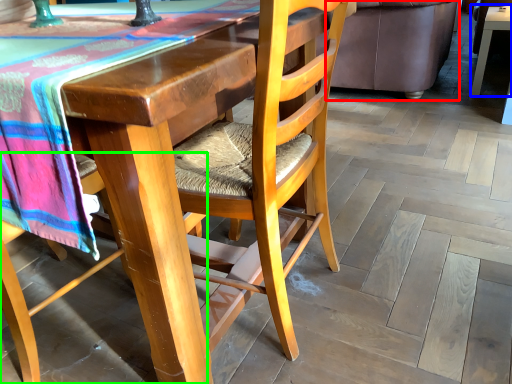
Question: Considering the real-world distances, which object is closest to couch (highlighted by a red box)? table (highlighted by a blue box) or chair (highlighted by a green box).

Choices:
 (A) table
 (B) chair

Answer: (A)